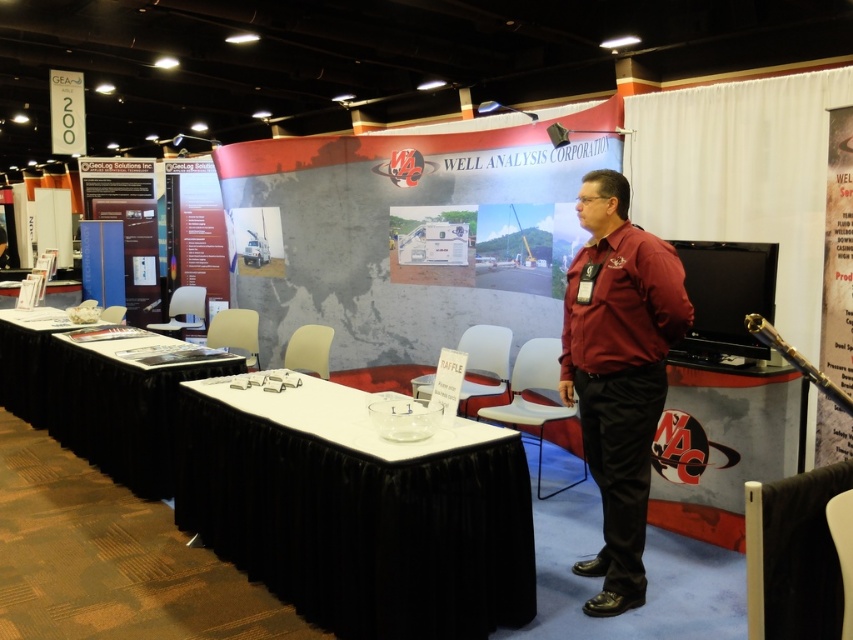
Consider the image. You are organizing a trade show booth and need to place a large banner stand that requires a table with sufficient width. Given the white glossy table at center and the black fabric table at lower left, which table should you choose to ensure the banner stand fits properly?

The black fabric table at lower left has a greater width than the white glossy table at center, so you should choose the black fabric table at lower left to ensure the banner stand fits properly.

You are attending the WAC Well Analysis Corporation trade show booth and notice a person wearing a maroon shirt at center. Where exactly is this person positioned in relation to the booth?

The maroon shirt at center is located at point coordinates approximately 0.583 on the x and 0.726 on the y axis within the booth layout.